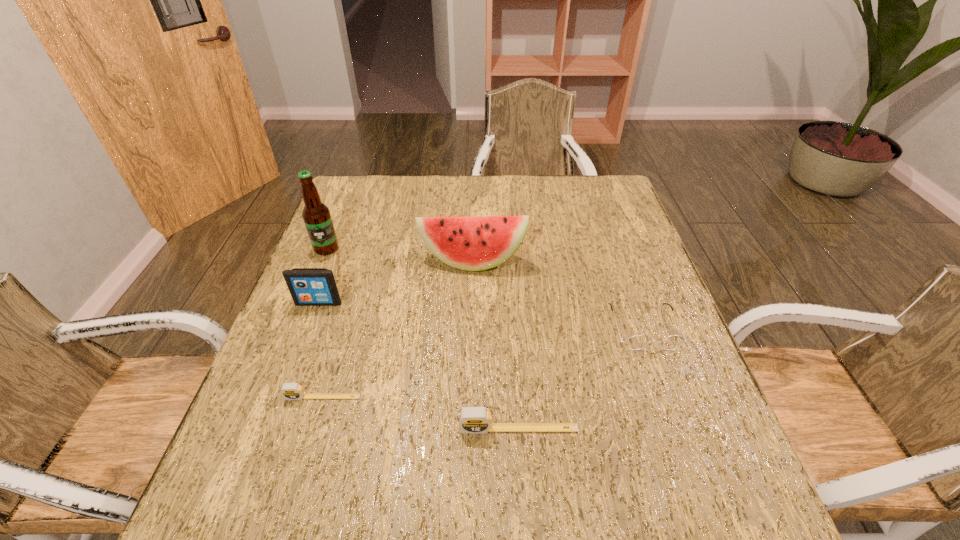
Where is `vacant space situated 0.140m on the outer rind of the watermelon`? The width and height of the screenshot is (960, 540). vacant space situated 0.140m on the outer rind of the watermelon is located at coordinates (470, 315).

Image resolution: width=960 pixels, height=540 pixels. Identify the location of vacant region located 0.200m on the front screen of the third tallest object. [x=292, y=375].

Find the location of `vacant region located 0.090m on the front-facing side of the rightmost object`. vacant region located 0.090m on the front-facing side of the rightmost object is located at coordinates (664, 387).

Find the location of a particular element. Image resolution: width=960 pixels, height=540 pixels. object located in the near edge section of the desktop is located at coordinates (474, 420).

Locate an element on the screen. tape measure located at the left edge is located at coordinates (291, 391).

Find the location of a particular element. This screenshot has height=540, width=960. beer bottle that is at the left edge is located at coordinates (316, 215).

The image size is (960, 540). What are the coordinates of `iPod present at the left edge` in the screenshot? It's located at (308, 286).

You are a GUI agent. You are given a task and a screenshot of the screen. Output one action in this format:
    pyautogui.click(x=<x>, y=<y>)
    Task: Click on the object that is at the right edge
    This screenshot has height=540, width=960.
    Given the screenshot: What is the action you would take?
    pyautogui.click(x=636, y=342)

Image resolution: width=960 pixels, height=540 pixels. In the image, there is a desktop. What are the coordinates of `vacant space at the far edge` in the screenshot? It's located at (535, 191).

Where is `vacant region at the near edge of the desktop`? This screenshot has height=540, width=960. vacant region at the near edge of the desktop is located at coordinates (605, 439).